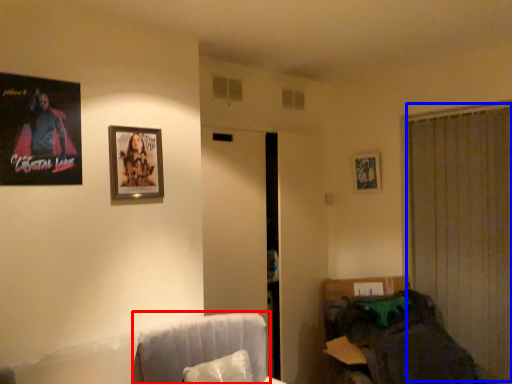
Question: Which point is further to the camera, swivel chair (highlighted by a red box) or curtain (highlighted by a blue box)?

Choices:
 (A) swivel chair
 (B) curtain

Answer: (B)